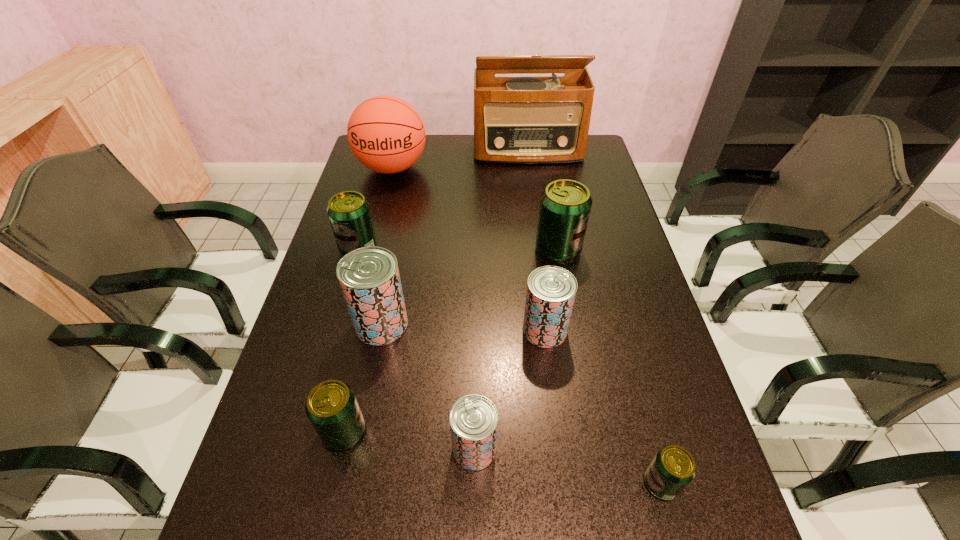
The height and width of the screenshot is (540, 960). What are the coordinates of `green beer can that stands as the third closest to the third biggest green beer can` in the screenshot? It's located at (565, 205).

Identify the location of red beer can that is the closest one to the tallest object. The image size is (960, 540). coord(369,278).

You are a GUI agent. You are given a task and a screenshot of the screen. Output one action in this format:
    pyautogui.click(x=<x>, y=<y>)
    Task: Click on the third closest red beer can to the biggest green beer can
    
    Given the screenshot: What is the action you would take?
    pyautogui.click(x=473, y=419)

At what (x,y) coordinates should I click in order to perform the action: click on vacant space that satisfies the following two spatial constraints: 1. on the front panel of the smallest green beer can; 2. on the right side of the radio receiver. Please return your answer as a coordinate pair (x, y). Image resolution: width=960 pixels, height=540 pixels. Looking at the image, I should click on (576, 483).

The image size is (960, 540). Identify the location of free spot that satisfies the following two spatial constraints: 1. on the front side of the rightmost beer can; 2. on the right side of the leftmost red beer can. (350, 483).

Identify the location of vacant space that satisfies the following two spatial constraints: 1. on the front side of the second biggest green beer can; 2. on the left side of the biggest red beer can. (337, 325).

This screenshot has height=540, width=960. In order to click on free location that satisfies the following two spatial constraints: 1. on the side with logo of the nearest green beer can; 2. on the left side of the second tallest object in this screenshot , I will do `click(313, 483)`.

Locate an element on the screen. The image size is (960, 540). vacant region that satisfies the following two spatial constraints: 1. on the side with logo of the rightmost red beer can; 2. on the left side of the basketball is located at coordinates (351, 330).

The height and width of the screenshot is (540, 960). Identify the location of free location that satisfies the following two spatial constraints: 1. on the front side of the third smallest green beer can; 2. on the left side of the rightmost red beer can. click(x=335, y=330).

Locate an element on the screen. The width and height of the screenshot is (960, 540). free space that satisfies the following two spatial constraints: 1. on the front side of the second biggest green beer can; 2. on the left side of the third farthest green beer can is located at coordinates (307, 431).